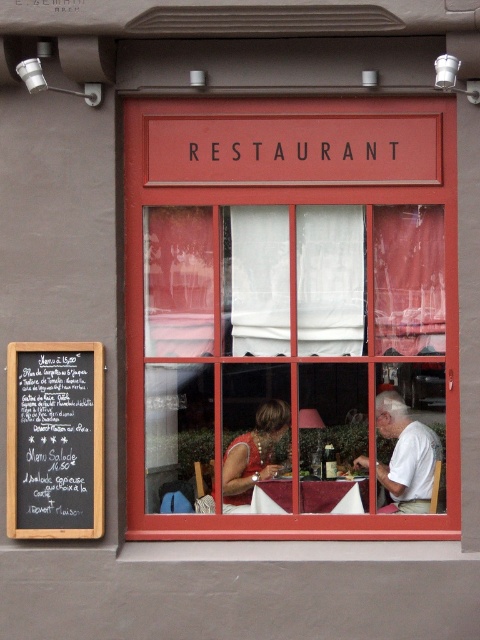
Is white cotton shirt at lower right further to camera compared to matte red dress at center?

No.

Does white cotton shirt at lower right have a greater width compared to matte red dress at center?

Yes, white cotton shirt at lower right is wider than matte red dress at center.

Locate an element on the screen. The image size is (480, 640). white cotton shirt at lower right is located at coordinates (406, 454).

At what (x,y) coordinates should I click in order to perform the action: click on black chalkboard at left. Please return your answer as a coordinate pair (x, y). The width and height of the screenshot is (480, 640). Looking at the image, I should click on (55, 440).

Which is more to the left, red wooden window at center or white cotton shirt at lower right?

red wooden window at center

Does red wooden window at center lie behind white cotton shirt at lower right?

No.

Is point (315, 253) positioned in front of point (406, 433)?

No, it is not.

Locate an element on the screen. red wooden window at center is located at coordinates (291, 314).